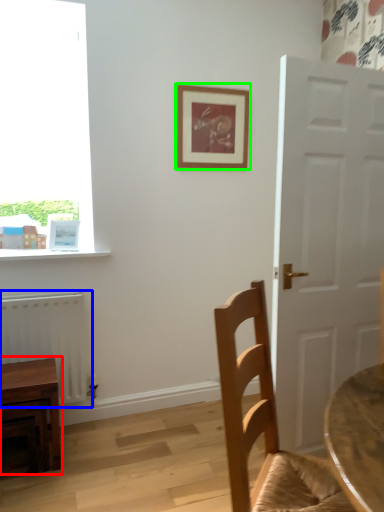
Question: Which is nearer to the table (highlighted by a red box)? radiator (highlighted by a blue box) or picture frame (highlighted by a green box).

Choices:
 (A) radiator
 (B) picture frame

Answer: (A)